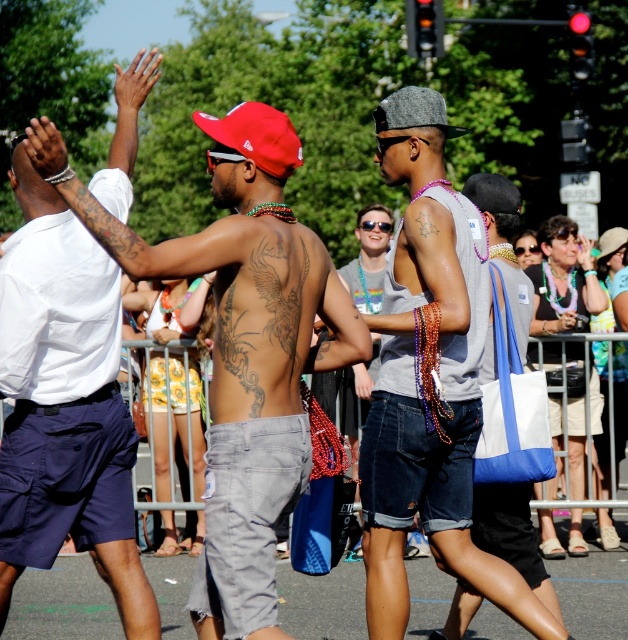
You are a photographer trying to capture both the shiny metallic tank top at center and the white cotton shirt at upper left in a single frame. Given their height difference, which clothing item will appear smaller in the photo?

The shiny metallic tank top at center will appear smaller in the photo because it has a lesser height compared to the white cotton shirt at upper left.

You are a photographer positioned at the front of the crowd. You want to take a photo of both the brown tattooed back at center and the gray felt baseball cap at center. Which object should you focus on first to ensure both are in clear focus?

You should focus on the brown tattooed back at center first since it is closer to the viewer than the gray felt baseball cap at center. By focusing on the closer object, the farther one may still be in acceptable focus depending on the depth of field.